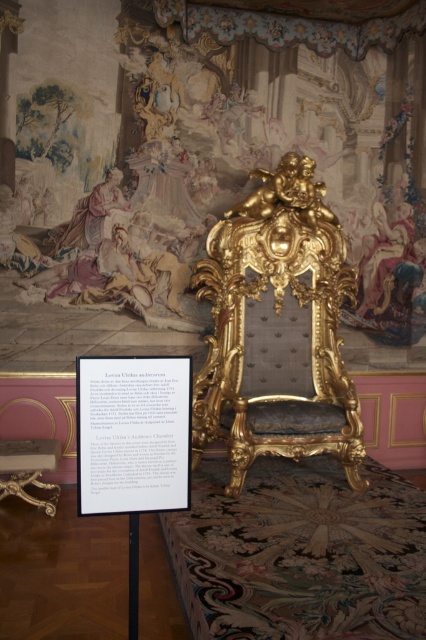
Question: Does white paper at center have a smaller size compared to gold polished wood table at lower left?

Choices:
 (A) no
 (B) yes

Answer: (B)

Question: Is gold upholstered armchair at center to the left of white paper at center from the viewer's perspective?

Choices:
 (A) yes
 (B) no

Answer: (B)

Question: Which object appears closest to the camera in this image?

Choices:
 (A) gold upholstered armchair at center
 (B) gold polished wood table at lower left

Answer: (B)

Question: Which point is closer to the camera?

Choices:
 (A) (16, 451)
 (B) (127, 419)
 (C) (322, 294)

Answer: (B)

Question: Considering the real-world distances, which object is farthest from the gold polished wood table at lower left?

Choices:
 (A) gold upholstered armchair at center
 (B) white paper at center

Answer: (B)

Question: Can you confirm if gold upholstered armchair at center is positioned below gold polished wood table at lower left?

Choices:
 (A) yes
 (B) no

Answer: (B)